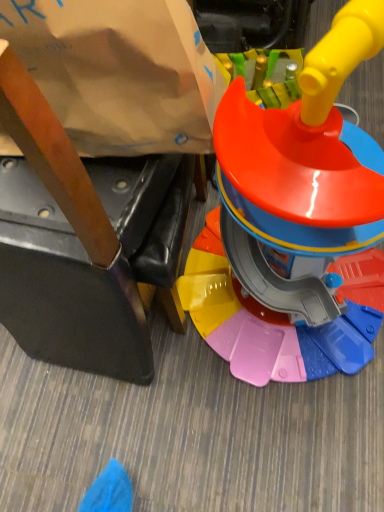
What do you see at coordinates (289, 214) in the screenshot?
I see `shiny plastic toy at right` at bounding box center [289, 214].

Identify the location of shiny plastic toy at right. The image size is (384, 512). (289, 214).

Identify the location of shiny plastic toy at right. The image size is (384, 512). (289, 214).